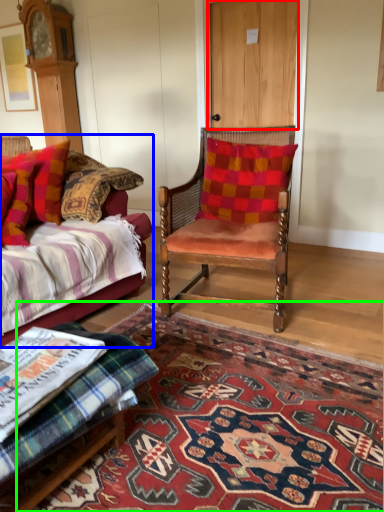
Question: Estimate the real-world distances between objects in this image. Which object is closer to door (highlighted by a red box), studio couch (highlighted by a blue box) or mat (highlighted by a green box)?

Choices:
 (A) studio couch
 (B) mat

Answer: (A)